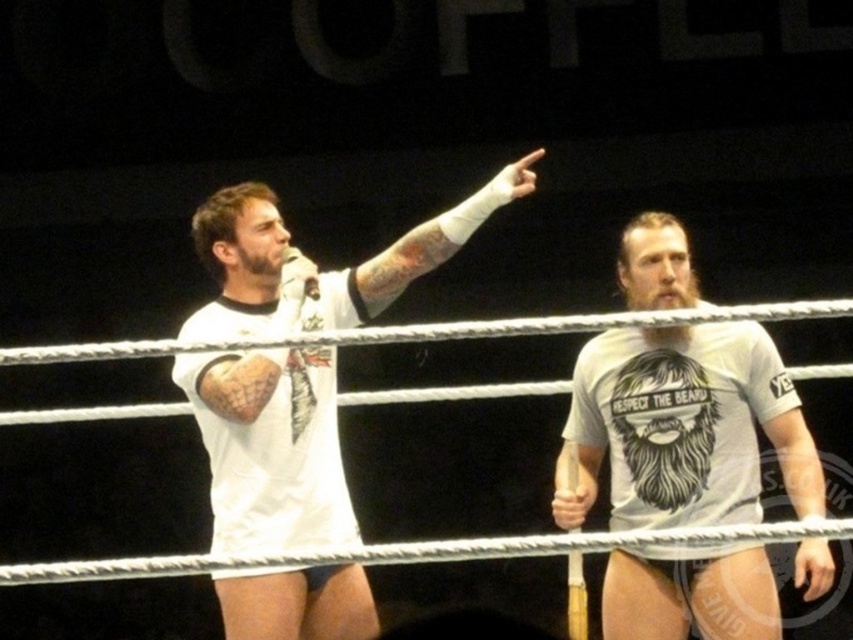
Question: Which point appears farthest from the camera in this image?

Choices:
 (A) (692, 426)
 (B) (397, 266)

Answer: (B)

Question: Can you confirm if white matte t-shirt at center is positioned below white matte t-shirt at upper left?

Choices:
 (A) no
 (B) yes

Answer: (B)

Question: Which of the following is the farthest from the observer?

Choices:
 (A) (676, 369)
 (B) (339, 595)

Answer: (A)

Question: Which point appears closest to the camera in this image?

Choices:
 (A) (318, 490)
 (B) (648, 273)

Answer: (A)

Question: Does white matte t-shirt at center appear on the right side of white matte t-shirt at upper left?

Choices:
 (A) no
 (B) yes

Answer: (B)

Question: Can you confirm if white matte t-shirt at center is bigger than white matte t-shirt at upper left?

Choices:
 (A) no
 (B) yes

Answer: (A)